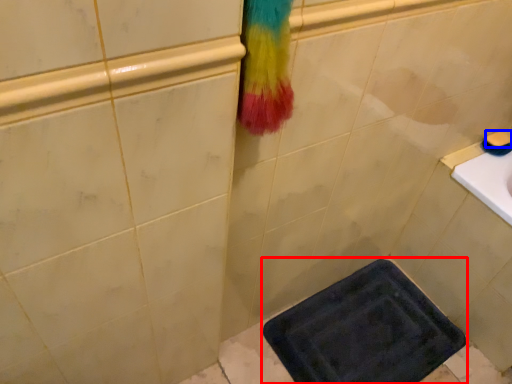
Question: Which object is closer to the camera taking this photo, bath mat (highlighted by a red box) or soap (highlighted by a blue box)?

Choices:
 (A) bath mat
 (B) soap

Answer: (A)